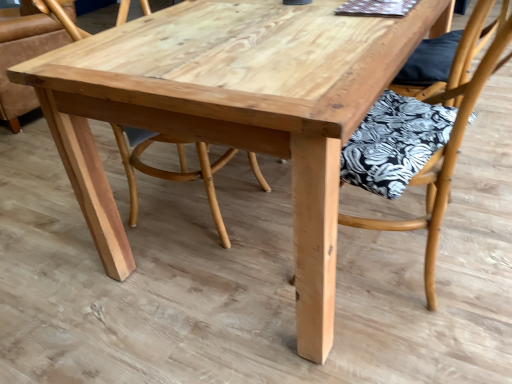
What are the coordinates of `empty space that is to the right of wooden chair with floral cushion at center, which ranks as the 2th chair in back-to-front order` in the screenshot? It's located at (483, 216).